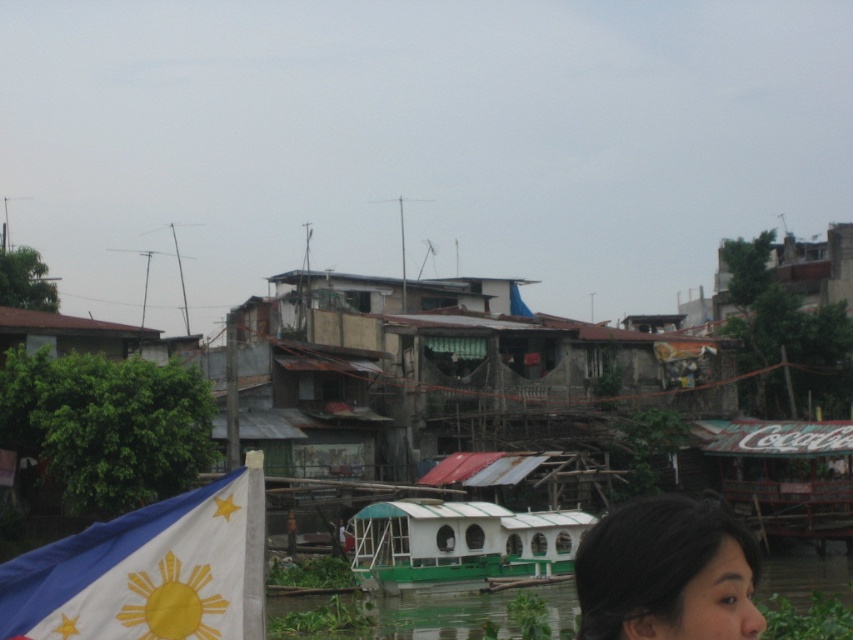
Question: Which object is closer to the camera taking this photo?

Choices:
 (A) white fabric flag at lower left
 (B) green matte boat at center

Answer: (A)

Question: Is white fabric flag at lower left to the left of dark brown hair at lower right from the viewer's perspective?

Choices:
 (A) yes
 (B) no

Answer: (A)

Question: Is dark brown hair at lower right below green matte boat at center?

Choices:
 (A) yes
 (B) no

Answer: (B)

Question: Which is nearer to the green matte boat at center?

Choices:
 (A) dark brown hair at lower right
 (B) white fabric flag at lower left

Answer: (A)

Question: Which is farther from the white fabric flag at lower left?

Choices:
 (A) dark brown hair at lower right
 (B) green matte boat at center

Answer: (B)

Question: In this image, where is white fabric flag at lower left located relative to dark brown hair at lower right?

Choices:
 (A) below
 (B) above

Answer: (B)